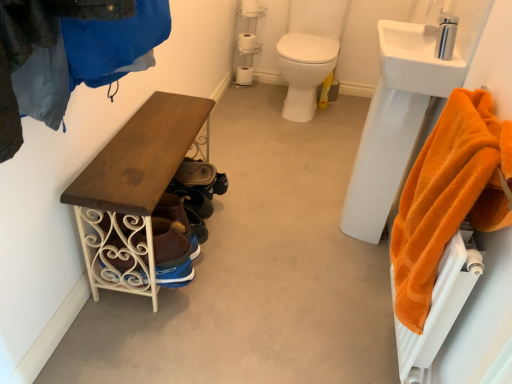
This screenshot has height=384, width=512. In order to click on vacant space in front of white matte toilet paper at center, the 3th toilet paper viewed from the top in this screenshot , I will do `click(242, 87)`.